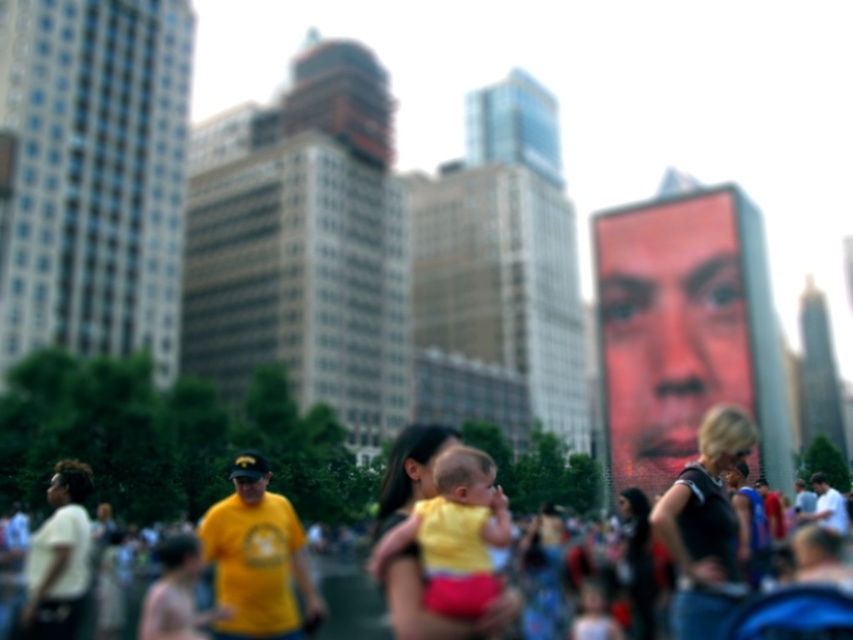
Question: In this image, where is yellow fabric baby at center located relative to white matte shirt at lower left?

Choices:
 (A) left
 (B) right

Answer: (B)

Question: Can you confirm if black matte dress at center is wider than yellow fabric baby at center?

Choices:
 (A) no
 (B) yes

Answer: (B)

Question: Can you confirm if black matte dress at center is thinner than white matte shirt at lower left?

Choices:
 (A) yes
 (B) no

Answer: (B)

Question: Which point is farther from the camera taking this photo?

Choices:
 (A) (705, 464)
 (B) (56, 522)

Answer: (B)

Question: Which object appears closest to the camera in this image?

Choices:
 (A) white matte shirt at lower left
 (B) black matte dress at center
 (C) yellow fabric baby at center

Answer: (C)

Question: Which object is the closest to the white matte shirt at lower left?

Choices:
 (A) black matte dress at center
 (B) yellow fabric baby at center

Answer: (B)